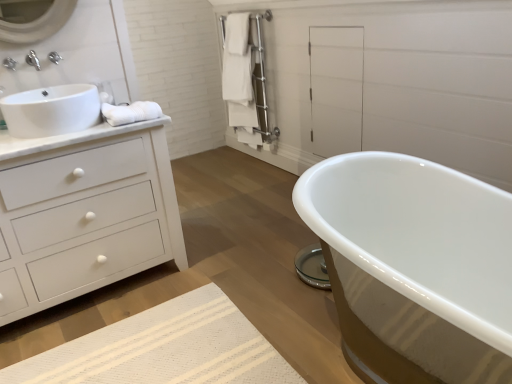
Question: Relative to brushed metal faucet at upper left, which is the 1th faucet from front to back, is white towel at left in front or behind?

Choices:
 (A) front
 (B) behind

Answer: (A)

Question: In terms of size, does white towel at left appear bigger or smaller than brushed metal faucet at upper left, which is the 1th faucet from front to back?

Choices:
 (A) small
 (B) big

Answer: (B)

Question: Which of these objects is positioned farthest from the white glossy sink at left?

Choices:
 (A) white towel at left
 (B) brushed metal faucet at upper left, the 2th faucet viewed from the back
 (C) white matte chest of drawers at left
 (D) white matte cabinet at upper center
 (E) satin nickel towel rack at upper center

Answer: (E)

Question: Based on their relative distances, which object is farther from the satin nickel towel rack at upper center?

Choices:
 (A) white matte chest of drawers at left
 (B) white glossy sink at left
 (C) brushed metal faucet at upper left, which ranks as the 1th faucet in right-to-left order
 (D) white towel at left
 (E) white matte cabinet at upper center

Answer: (B)